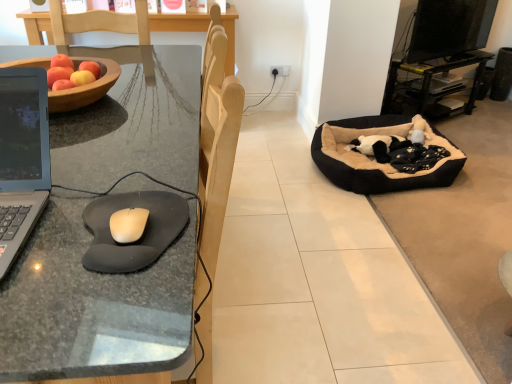
I want to click on vacant area that lies in front of white matte mouse at left, so click(100, 309).